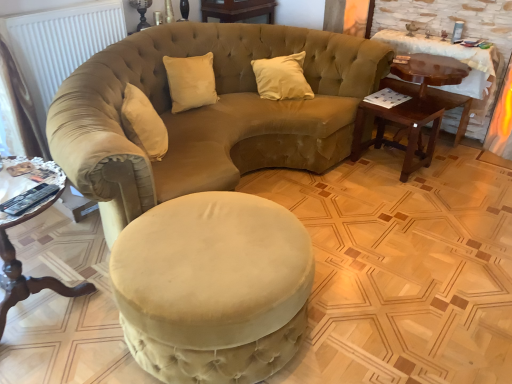
Question: Choose the correct answer: Is beige velvet pillow at center inside velvet beige studio couch at center or outside it?

Choices:
 (A) outside
 (B) inside

Answer: (B)

Question: From a real-world perspective, is beige velvet pillow at center physically located above or below velvet beige studio couch at center?

Choices:
 (A) above
 (B) below

Answer: (A)

Question: Estimate the real-world distances between objects in this image. Which object is farther from the beige velvet pillow at center?

Choices:
 (A) white matte radiator at upper left
 (B) dark brown wood side table at right, the 2th table when ordered from front to back
 (C) velvet beige studio couch at center
 (D) wooden round table at lower left, the 3th table from the back
 (E) mahogany wood side table at right, the 3th table in the left-to-right sequence

Answer: (D)

Question: Estimate the real-world distances between objects in this image. Which object is closer to the wooden round table at lower left, the 1th table when ordered from left to right?

Choices:
 (A) dark brown wood side table at right, the second table in the left-to-right sequence
 (B) mahogany wood side table at right, the 3th table in the left-to-right sequence
 (C) velvet beige studio couch at center
 (D) beige velvet pillow at center
 (E) velvet beige ottoman at center

Answer: (E)